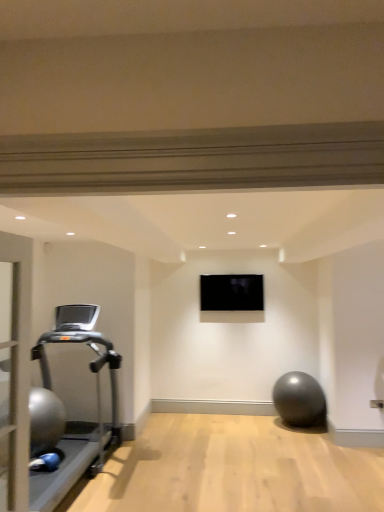
Question: Should I look upward or downward to see silver metallic treadmill at left?

Choices:
 (A) up
 (B) down

Answer: (B)

Question: Is black glossy tv at center thinner than silver metallic treadmill at left?

Choices:
 (A) yes
 (B) no

Answer: (A)

Question: Can you confirm if black glossy tv at center is bigger than silver metallic treadmill at left?

Choices:
 (A) yes
 (B) no

Answer: (B)

Question: Is black glossy tv at center not close to silver metallic treadmill at left?

Choices:
 (A) yes
 (B) no

Answer: (A)

Question: Is black glossy tv at center looking in the opposite direction of silver metallic treadmill at left?

Choices:
 (A) yes
 (B) no

Answer: (B)

Question: Is black glossy tv at center behind silver metallic treadmill at left?

Choices:
 (A) no
 (B) yes

Answer: (B)

Question: Is black glossy tv at center to the left of silver metallic treadmill at left from the viewer's perspective?

Choices:
 (A) yes
 (B) no

Answer: (B)

Question: From the image's perspective, is silver metallic treadmill at left located beneath black glossy tv at center?

Choices:
 (A) no
 (B) yes

Answer: (B)

Question: Is silver metallic treadmill at left touching black glossy tv at center?

Choices:
 (A) yes
 (B) no

Answer: (B)

Question: Does silver metallic treadmill at left have a greater height compared to black glossy tv at center?

Choices:
 (A) yes
 (B) no

Answer: (A)

Question: From a real-world perspective, is silver metallic treadmill at left on top of black glossy tv at center?

Choices:
 (A) yes
 (B) no

Answer: (B)

Question: Is silver metallic treadmill at left positioned beyond the bounds of black glossy tv at center?

Choices:
 (A) no
 (B) yes

Answer: (B)

Question: Is silver metallic treadmill at left wider than black glossy tv at center?

Choices:
 (A) yes
 (B) no

Answer: (A)

Question: Considering the positions of black glossy tv at center and silver metallic treadmill at left in the image, is black glossy tv at center wider or thinner than silver metallic treadmill at left?

Choices:
 (A) wide
 (B) thin

Answer: (B)